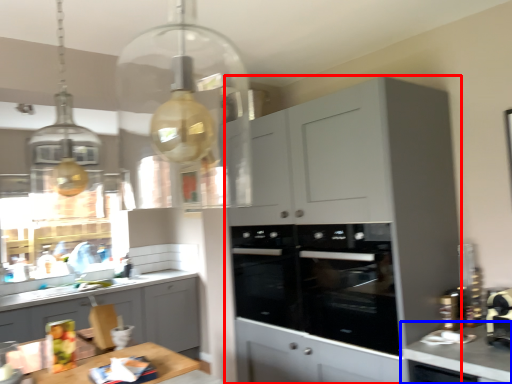
Question: Which object is further to the camera taking this photo, cabinetry (highlighted by a red box) or countertop (highlighted by a blue box)?

Choices:
 (A) cabinetry
 (B) countertop

Answer: (A)